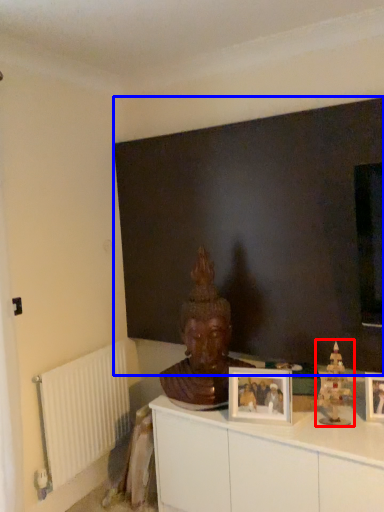
Question: Which object appears closest to the camera in this image, toy (highlighted by a red box) or backdrop (highlighted by a blue box)?

Choices:
 (A) toy
 (B) backdrop

Answer: (A)